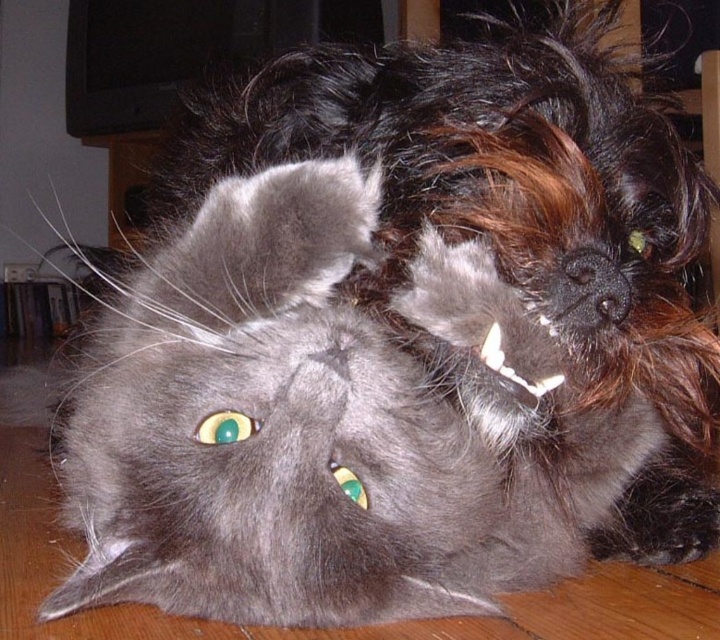
Based on the photo, is soft gray fur cat at center positioned behind shiny black fur at center?

Yes.

Identify the location of soft gray fur cat at center. The width and height of the screenshot is (720, 640). (328, 422).

Between point (243, 230) and point (657, 161), which one is positioned in front?

Point (243, 230) is more forward.

Identify the location of soft gray fur cat at center. The width and height of the screenshot is (720, 640). (328, 422).